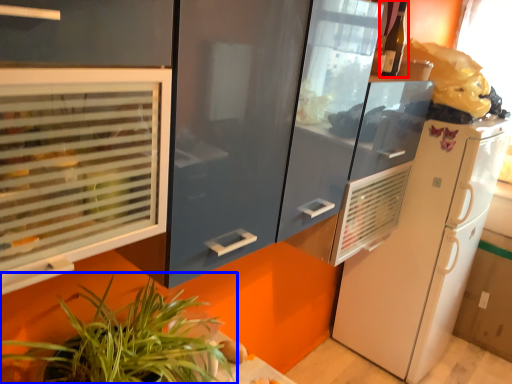
Question: Which of the following is the farthest to the observer, wine bottle (highlighted by a red box) or houseplant (highlighted by a blue box)?

Choices:
 (A) wine bottle
 (B) houseplant

Answer: (A)